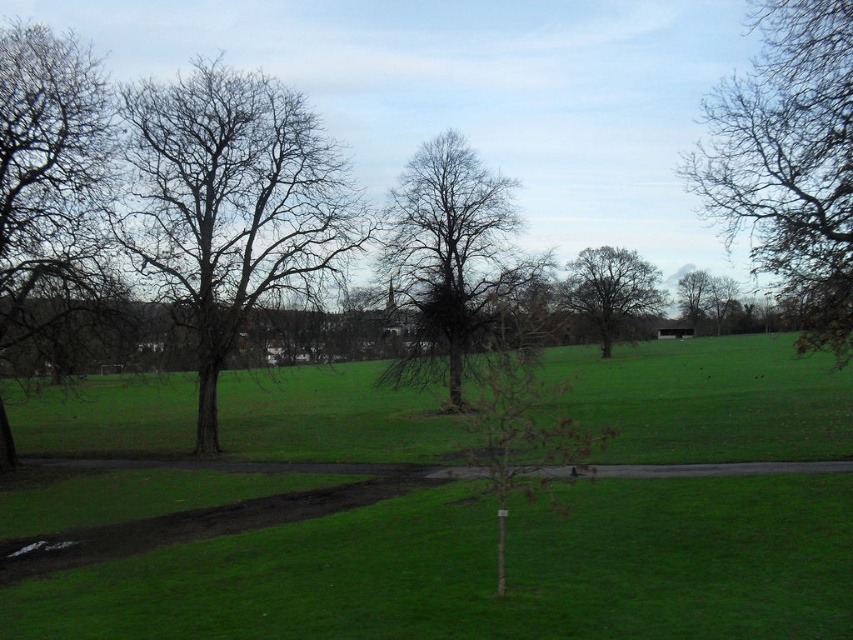
Question: Estimate the real-world distances between objects in this image. Which object is closer to the bare branches at upper right?

Choices:
 (A) brown leafless tree at center
 (B) green grass at center
 (C) bare branches tree at left

Answer: (B)

Question: Does bare branches tree at center appear on the left side of brown leafless tree at center?

Choices:
 (A) no
 (B) yes

Answer: (B)

Question: Is bare branches at upper right below bare branches tree at center?

Choices:
 (A) no
 (B) yes

Answer: (A)

Question: Estimate the real-world distances between objects in this image. Which object is closer to the bare branches tree at center?

Choices:
 (A) bare branches tree at left
 (B) bare branches at left
 (C) brown leafless tree at center
 (D) green grass at center

Answer: (A)

Question: Is bare branches tree at left closer to camera compared to brown leafless tree at center?

Choices:
 (A) yes
 (B) no

Answer: (B)

Question: Which point is farther to the camera?

Choices:
 (A) (500, 308)
 (B) (624, 369)
 (C) (235, 340)
 (D) (784, 45)

Answer: (B)